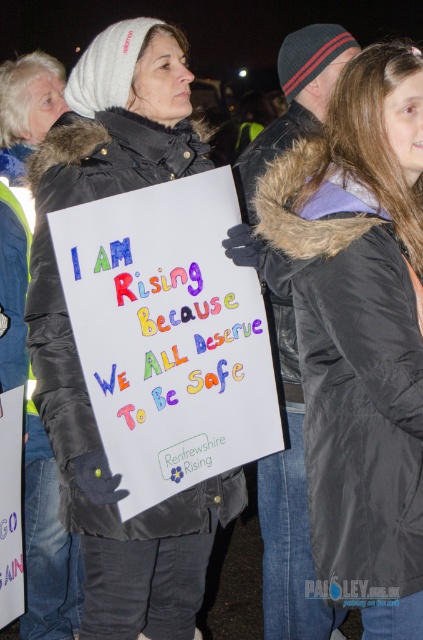
In the scene shown: You are a photographer trying to capture the protest scene. You notice two points of interest in the image at coordinates point [353,77] and point [175,500]. Which point should you focus on to ensure it appears larger in your photo?

Point [353,77] is closer to the camera than point [175,500], so focusing on point [353,77] will make it appear larger in the photo.